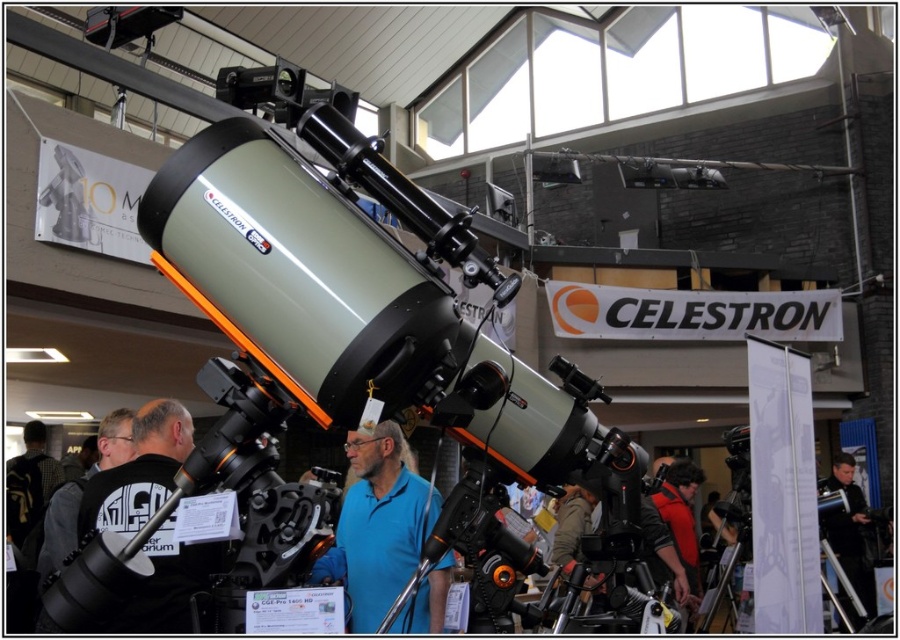
Question: Is black fabric shirt at center to the right of black matte jacket at center from the viewer's perspective?

Choices:
 (A) yes
 (B) no

Answer: (B)

Question: Is blue matte shirt at center further to the viewer compared to black fabric shirt at center?

Choices:
 (A) no
 (B) yes

Answer: (B)

Question: Which object appears closest to the camera in this image?

Choices:
 (A) blue matte shirt at center
 (B) black matte jacket at center
 (C) black fabric shirt at center

Answer: (C)

Question: Which object is farther from the camera taking this photo?

Choices:
 (A) black matte jacket at center
 (B) black fabric shirt at center

Answer: (A)

Question: Which object appears closest to the camera in this image?

Choices:
 (A) black fabric shirt at center
 (B) black matte jacket at center

Answer: (A)

Question: Can you confirm if blue matte shirt at center is positioned below black matte jacket at center?

Choices:
 (A) yes
 (B) no

Answer: (B)